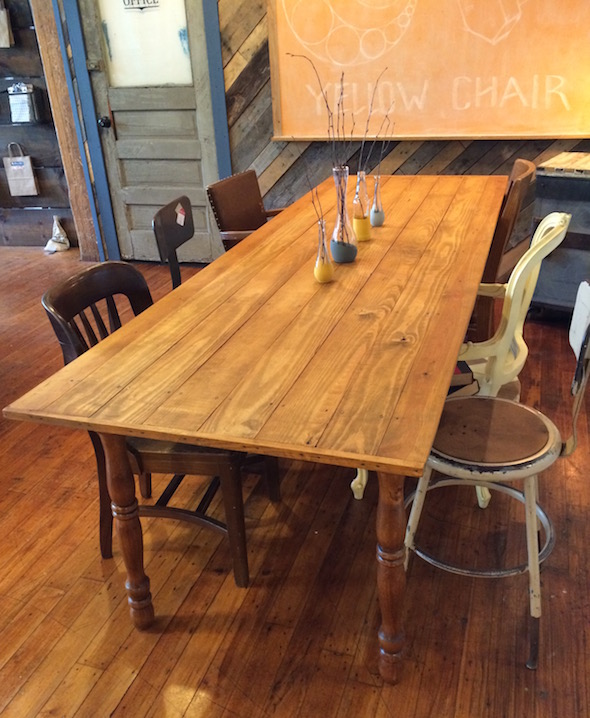
Find the location of a particular element. Image resolution: width=590 pixels, height=718 pixels. words on yellow painting saying "yellow chair" is located at coordinates (489, 88), (409, 93).